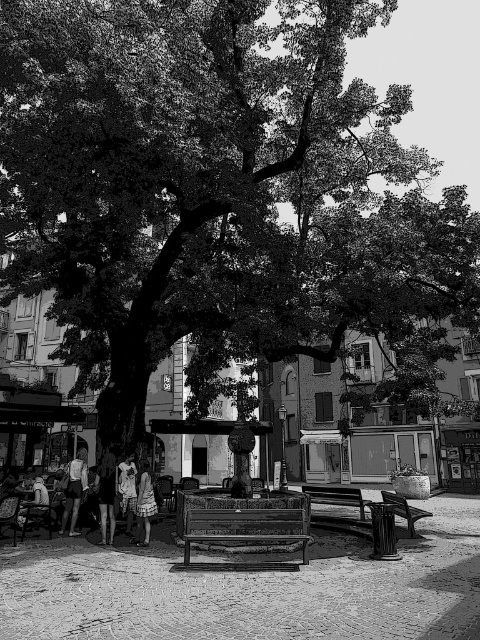
Question: Does rustic wood bench at center have a larger size compared to wooden bench at lower right?

Choices:
 (A) no
 (B) yes

Answer: (A)

Question: Is wooden park bench at center smaller than light brown fabric dress at center?

Choices:
 (A) yes
 (B) no

Answer: (B)

Question: Is the position of dark fabric dress at center less distant than that of wooden park bench at center?

Choices:
 (A) yes
 (B) no

Answer: (A)

Question: Among these points, which one is nearest to the camera?

Choices:
 (A) (97, 499)
 (B) (314, 486)

Answer: (A)

Question: Which of the following is the closest to the observer?

Choices:
 (A) rustic wood bench at center
 (B) matte black shorts at lower left
 (C) white cotton dress at center
 (D) wooden bench at lower right

Answer: (A)

Question: Which point is farther to the camera?

Choices:
 (A) matte black shorts at lower left
 (B) rustic wood bench at center
 (C) matte black dress at lower left

Answer: (A)